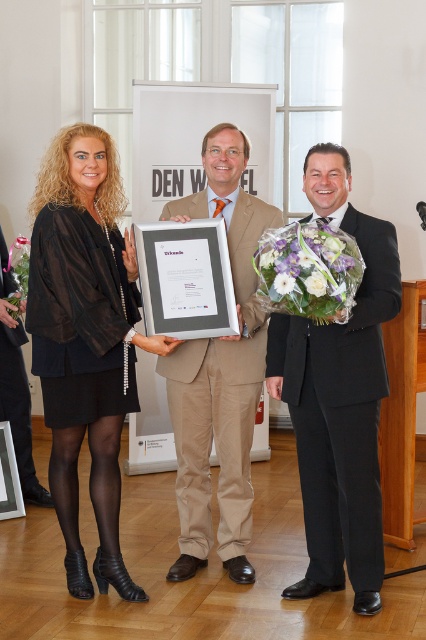
You are standing in the conference hall and want to reach the podium in the background. You notice two points marked in the image at coordinates point [249,264] and point [305,310]. Which point should you walk towards if you want to get closer to the podium?

You should walk towards point [305,310] because it is further away from the camera and closer to the podium in the background.

You are a photographer at the event and need to place a small decorative item between the white floral bouquet at center and the white silk flower at center. Given that the item is 3 inches wide, will it fit perfectly between them without overlapping either?

The white floral bouquet at center and white silk flower at center are 6.06 inches apart. The 3 inch wide item can fit between them as it is narrower than the space available.

You are a photographer standing at the back of the room. You need to adjust the lighting so that both the matte silver frame at center and the white floral bouquet at center are equally illuminated. Given their current distance apart, can you estimate if the lighting setup will require moving the light source closer or farther away to achieve even illumination?

The distance between the matte silver frame at center and the white floral bouquet at center is 23.65 inches. To achieve even illumination, the light source should be positioned equidistant from both objects. Since they are already 23.65 inches apart, moving the light source closer would reduce the difference in light intensity between them, while moving it farther away might increase the disparity. However, without knowing the current distance of the light source from the subjects, an exact adjustment can